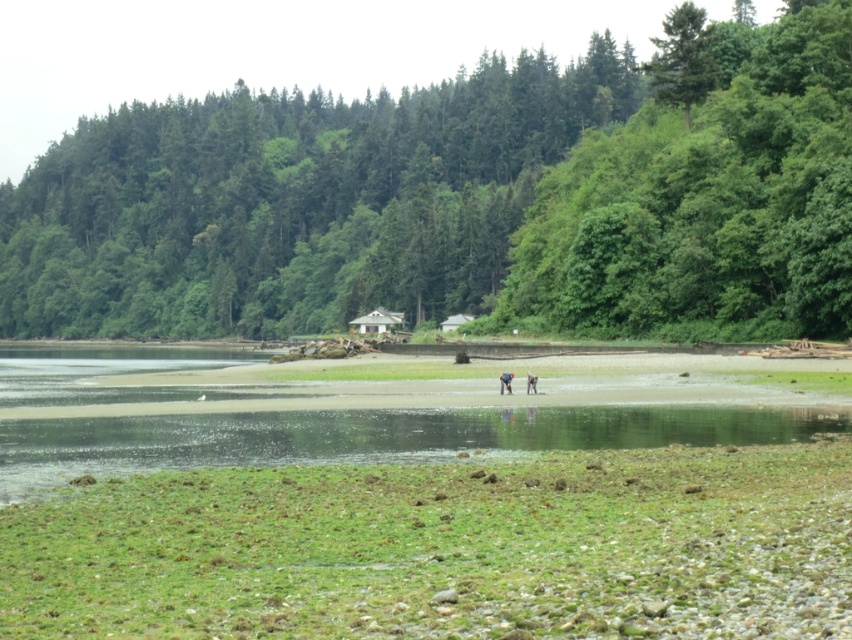
Question: Which object appears closest to the camera in this image?

Choices:
 (A) green leafy tree at center
 (B) dark gray fabric person at center
 (C) light brown leather jacket at center

Answer: (B)

Question: Estimate the real-world distances between objects in this image. Which object is closer to the green leafy tree at center?

Choices:
 (A) light brown leather jacket at center
 (B) dark gray fabric person at center

Answer: (A)

Question: Is green leafy tree at center smaller than light brown leather jacket at center?

Choices:
 (A) no
 (B) yes

Answer: (A)

Question: Is dark gray fabric person at center bigger than light brown leather jacket at center?

Choices:
 (A) yes
 (B) no

Answer: (A)

Question: Where is dark gray fabric person at center located in relation to light brown leather jacket at center in the image?

Choices:
 (A) below
 (B) above

Answer: (B)

Question: Among these points, which one is farthest from the camera?

Choices:
 (A) (527, 381)
 (B) (758, 104)
 (C) (499, 394)

Answer: (B)